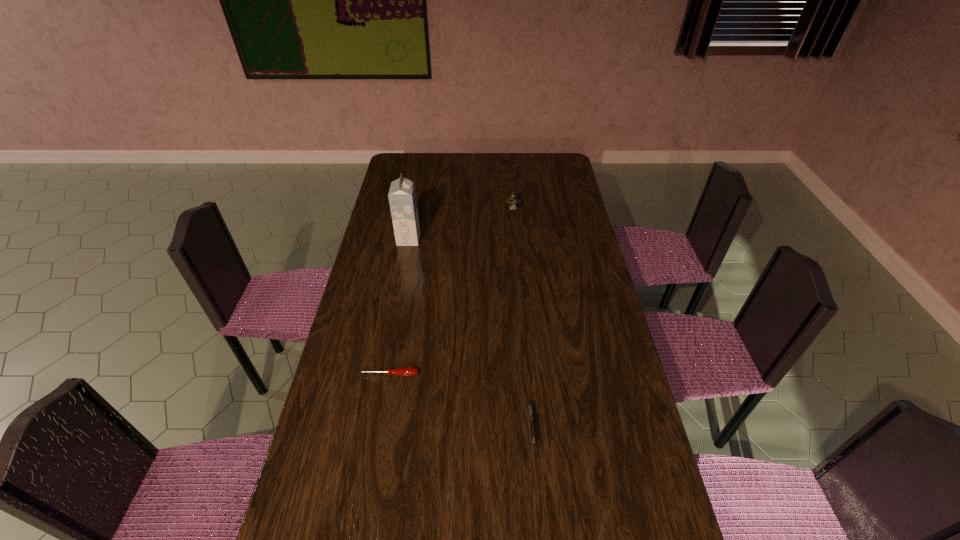
Locate an element on the screen. This screenshot has width=960, height=540. carton is located at coordinates (402, 196).

Identify the location of the tallest object. (402, 196).

You are a GUI agent. You are given a task and a screenshot of the screen. Output one action in this format:
    pyautogui.click(x=<x>, y=<y>)
    Task: Click on the third shortest object
    This screenshot has width=960, height=540.
    Given the screenshot: What is the action you would take?
    pyautogui.click(x=513, y=201)

At what (x,y) coordinates should I click in order to perform the action: click on the farthest object. Please return your answer as a coordinate pair (x, y). Looking at the image, I should click on (513, 201).

Identify the location of the nearest object. The height and width of the screenshot is (540, 960). (532, 430).

At what (x,y) coordinates should I click in order to perform the action: click on gun. Please return your answer as a coordinate pair (x, y). Looking at the image, I should click on point(532,430).

Locate an element on the screen. The width and height of the screenshot is (960, 540). screwdriver is located at coordinates (406, 371).

Locate an element on the screen. The width and height of the screenshot is (960, 540). the shortest object is located at coordinates (406, 371).

This screenshot has height=540, width=960. In order to click on blank space located on the front label of the third nearest object in this screenshot , I will do `click(478, 239)`.

The height and width of the screenshot is (540, 960). What are the coordinates of `free space located 0.370m on the face of the snail` in the screenshot? It's located at (520, 280).